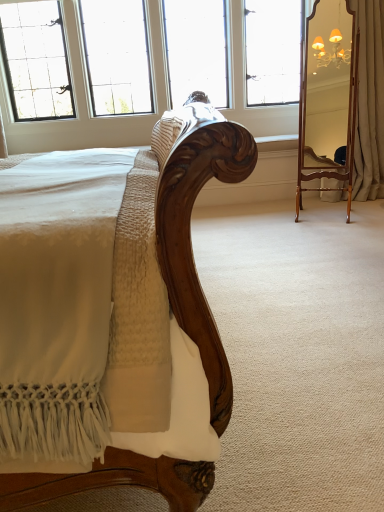
Question: Is wooden mirror at right at the right side of clear glass window at upper center?

Choices:
 (A) yes
 (B) no

Answer: (A)

Question: Is wooden mirror at right not close to clear glass window at upper center?

Choices:
 (A) no
 (B) yes

Answer: (B)

Question: Can you confirm if wooden mirror at right is taller than clear glass window at upper center?

Choices:
 (A) no
 (B) yes

Answer: (B)

Question: From the image's perspective, is wooden mirror at right beneath clear glass window at upper center?

Choices:
 (A) yes
 (B) no

Answer: (A)

Question: From the image's perspective, is wooden mirror at right over clear glass window at upper center?

Choices:
 (A) yes
 (B) no

Answer: (B)

Question: Does point (183, 13) appear closer or farther from the camera than point (349, 78)?

Choices:
 (A) farther
 (B) closer

Answer: (A)

Question: From a real-world perspective, is clear glass window at upper center positioned above or below wooden mirror at right?

Choices:
 (A) below
 (B) above

Answer: (B)

Question: Is clear glass window at upper center in front of or behind wooden mirror at right in the image?

Choices:
 (A) behind
 (B) front

Answer: (A)

Question: Considering the positions of clear glass window at upper center and wooden mirror at right in the image, is clear glass window at upper center wider or thinner than wooden mirror at right?

Choices:
 (A) thin
 (B) wide

Answer: (B)

Question: In terms of width, does wooden mirror at right look wider or thinner when compared to clear glass window at upper center?

Choices:
 (A) wide
 (B) thin

Answer: (B)

Question: Would you say wooden mirror at right is to the left or to the right of clear glass window at upper center in the picture?

Choices:
 (A) left
 (B) right

Answer: (B)

Question: Considering the positions of point (316, 125) and point (180, 10), is point (316, 125) closer or farther from the camera than point (180, 10)?

Choices:
 (A) farther
 (B) closer

Answer: (B)

Question: Considering their positions, is wooden mirror at right located in front of or behind clear glass window at upper center?

Choices:
 (A) front
 (B) behind

Answer: (A)

Question: From a real-world perspective, is clear glass window at upper center positioned above or below beige fabric curtain at right?

Choices:
 (A) below
 (B) above

Answer: (B)

Question: Do you think clear glass window at upper center is within beige fabric curtain at right, or outside of it?

Choices:
 (A) inside
 (B) outside

Answer: (B)